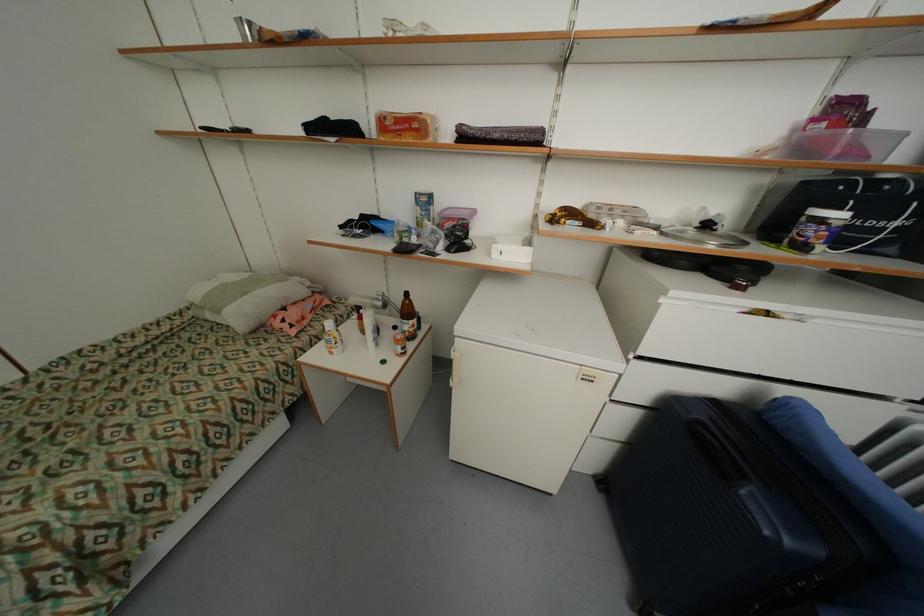
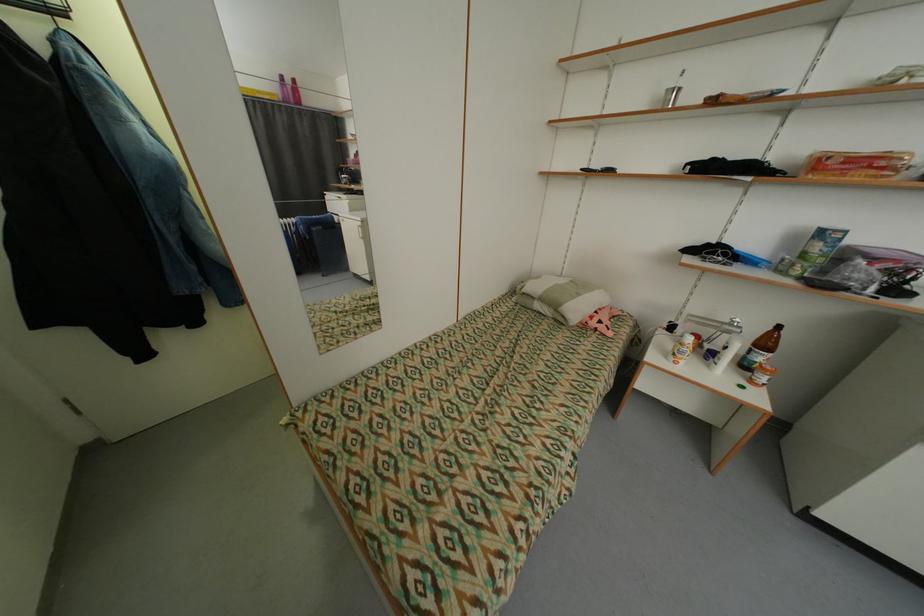
Where in the second image is the point corresponding to point (383, 301) from the first image?

(736, 326)